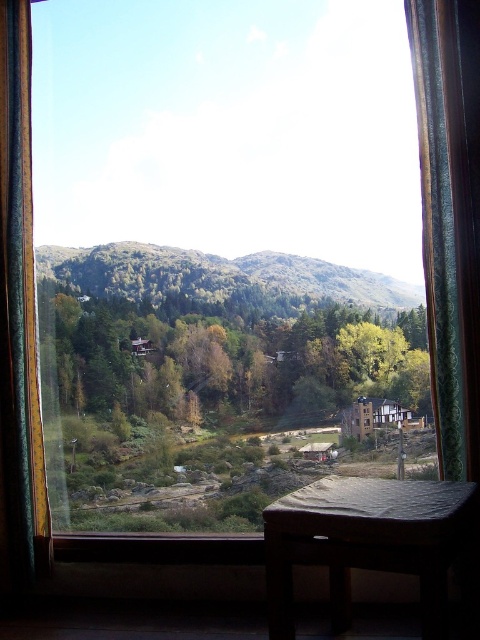
Question: Is transparent glass window at center behind green leafy forest at center?

Choices:
 (A) no
 (B) yes

Answer: (A)

Question: Which of the following is the farthest from the observer?

Choices:
 (A) green leafy forest at center
 (B) transparent glass window at center
 (C) green textured curtain at right

Answer: (A)

Question: Which point is closer to the camera taking this photo?

Choices:
 (A) (21, 145)
 (B) (468, 83)
 (C) (131, 278)

Answer: (B)

Question: Which point is closer to the camera taking this photo?

Choices:
 (A) (456, 444)
 (B) (148, 280)

Answer: (A)

Question: Can you confirm if transparent glass window at center is positioned to the left of green textured curtain at right?

Choices:
 (A) yes
 (B) no

Answer: (A)

Question: Can you confirm if wooden cushioned chair at lower center is bigger than green fabric curtain at left?

Choices:
 (A) no
 (B) yes

Answer: (B)